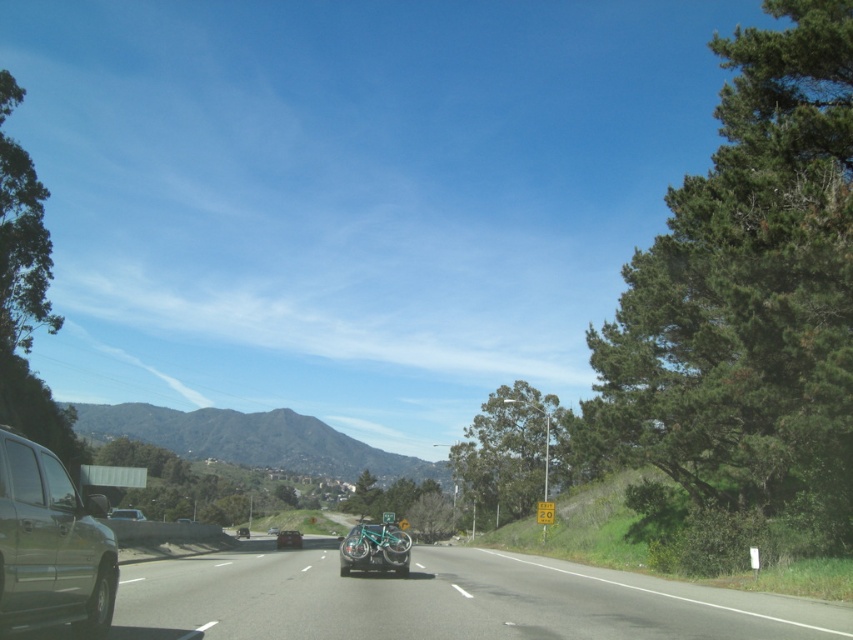
Does point (91, 602) come closer to viewer compared to point (273, 525)?

That is True.

Is point (73, 605) behind point (267, 531)?

No, it is not.

Where is `metallic green suv at left`? The image size is (853, 640). metallic green suv at left is located at coordinates (51, 545).

Does metallic green suv at left have a larger size compared to metallic silver car at center?

Actually, metallic green suv at left might be smaller than metallic silver car at center.

Describe the element at coordinates (51, 545) in the screenshot. The width and height of the screenshot is (853, 640). I see `metallic green suv at left` at that location.

This screenshot has width=853, height=640. Identify the location of metallic green suv at left. (x=51, y=545).

Can you confirm if teal metallic bicycle at center is taller than silver metallic sedan at center?

Indeed, teal metallic bicycle at center has a greater height compared to silver metallic sedan at center.

Is the position of teal metallic bicycle at center more distant than that of silver metallic sedan at center?

No.

Does point (345, 545) lie in front of point (271, 532)?

Yes, it is in front of point (271, 532).

Where is `teal metallic bicycle at center`? teal metallic bicycle at center is located at coordinates (375, 547).